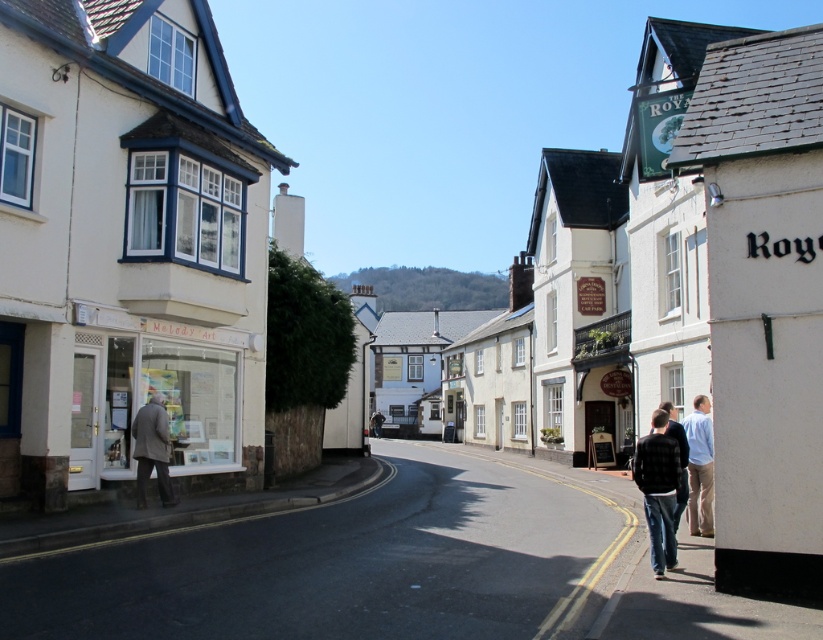
You are a delivery person who needs to park your 2.5 meter long delivery van on the street. The van requires a parking space that is at least 3 meters long. Looking at the scene, can you determine if there is enough space between the white wooden shop at left and the light brown wool coat at left to park your van?

The white wooden shop at left is bigger than the light brown wool coat at left, but the exact distance between them isn not provided. Therefore, it is uncertain whether there is sufficient space to park the van.

You are standing on the street in front of the Melody Art shop. You notice two points marked on the building facade. The first point is at coordinates point (231, 342) and the second is at point (138, 499). Which point is closer to you?

Point (138, 499) is closer to you because it is nearer to the camera compared to point (231, 342), which is further away.

Based on the photo, you are standing on the street in the scene. There is a point at coordinates (126, 243). Which object from the scene does this point belong to?

The point at coordinates (126, 243) belongs to the white wooden shop at left.